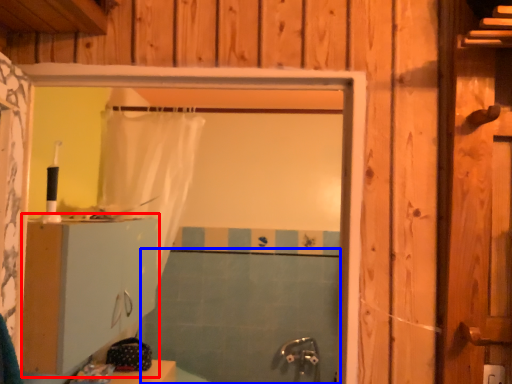
Question: Which point is closer to the camera, dresser (highlighted by a red box) or bath (highlighted by a blue box)?

Choices:
 (A) dresser
 (B) bath

Answer: (A)